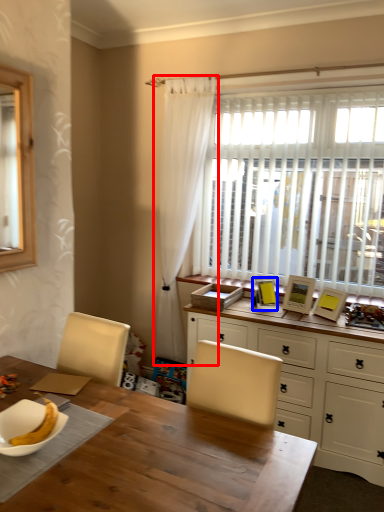
Question: Among these objects, which one is nearest to the camera, curtain (highlighted by a red box) or picture frame (highlighted by a blue box)?

Choices:
 (A) curtain
 (B) picture frame

Answer: (B)